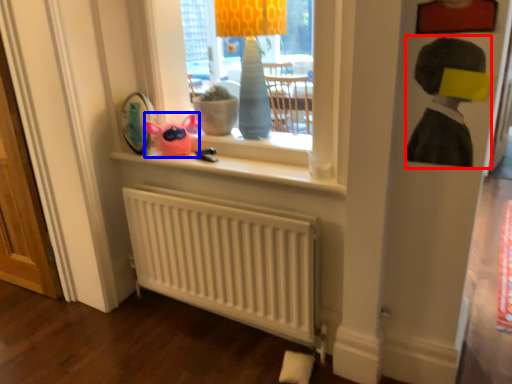
Question: Among these objects, which one is farthest to the camera, person (highlighted by a red box) or toy (highlighted by a blue box)?

Choices:
 (A) person
 (B) toy

Answer: (B)